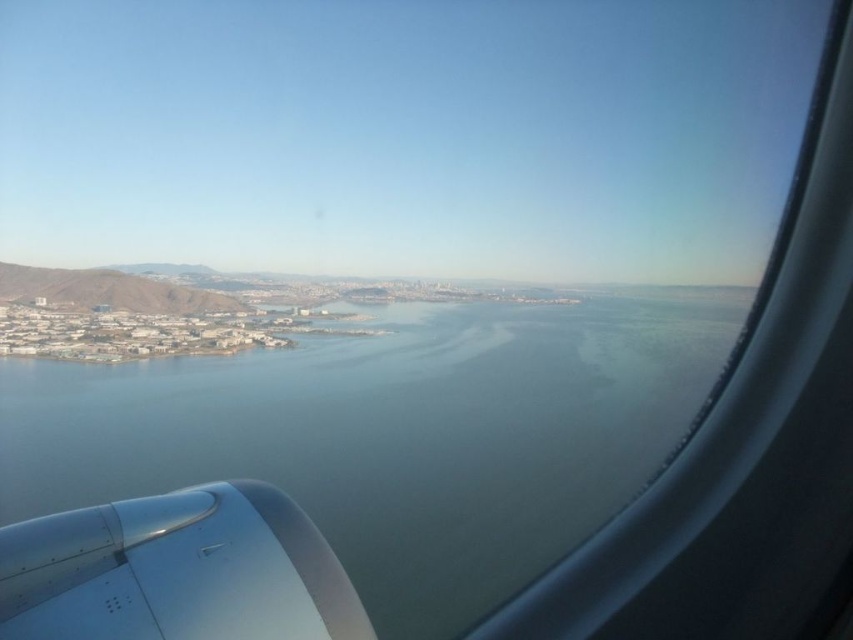
Question: Which point appears closest to the camera in this image?

Choices:
 (A) (363, 588)
 (B) (270, 632)
 (C) (86, 296)

Answer: (B)

Question: In this image, where is silver metallic engine at lower left located relative to green grassy hillside at left?

Choices:
 (A) above
 (B) below

Answer: (B)

Question: Does silver metallic engine at lower left appear over green grassy hillside at left?

Choices:
 (A) yes
 (B) no

Answer: (B)

Question: Considering the real-world distances, which object is farthest from the green grassy hillside at left?

Choices:
 (A) clear blue water at center
 (B) silver metallic engine at lower left

Answer: (B)

Question: Is silver metallic engine at lower left positioned behind green grassy hillside at left?

Choices:
 (A) no
 (B) yes

Answer: (A)

Question: Which point is closer to the camera taking this photo?

Choices:
 (A) (41, 602)
 (B) (51, 280)
 (C) (352, 360)

Answer: (A)